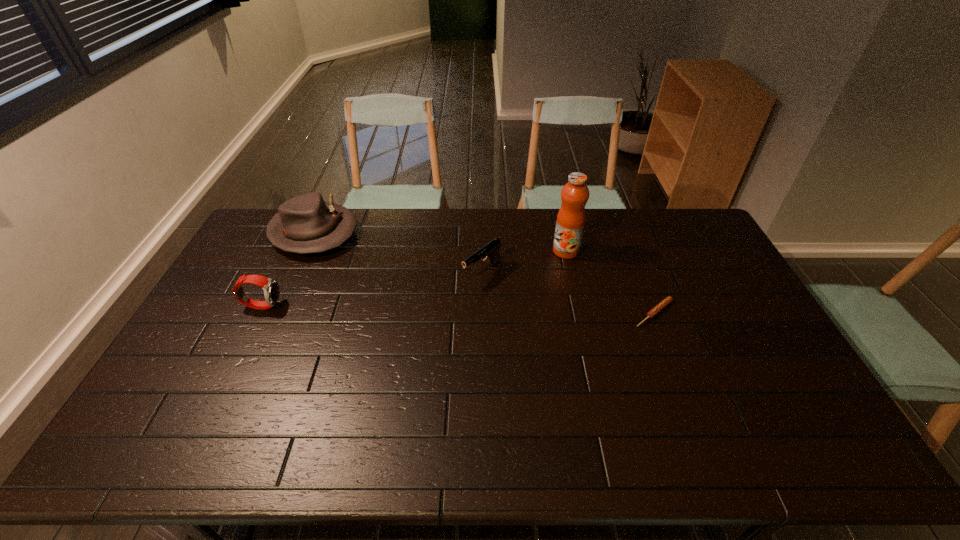
Where is `watch that is at the left edge`? This screenshot has width=960, height=540. watch that is at the left edge is located at coordinates (271, 289).

Where is `hat located at the left edge`? hat located at the left edge is located at coordinates (305, 224).

The image size is (960, 540). In order to click on object that is at the far left corner in this screenshot , I will do `click(305, 224)`.

Locate an element on the screen. free space at the far edge of the desktop is located at coordinates (495, 212).

Locate an element on the screen. free space at the near edge is located at coordinates (315, 393).

Image resolution: width=960 pixels, height=540 pixels. I want to click on vacant region at the right edge of the desktop, so click(x=717, y=280).

Where is `free location at the far left corner of the desktop`? Image resolution: width=960 pixels, height=540 pixels. free location at the far left corner of the desktop is located at coordinates (258, 228).

Identify the location of free space between the watch and the rightmost object. (458, 309).

Where is `free space between the fourth object from left to right and the rightmost object`? free space between the fourth object from left to right and the rightmost object is located at coordinates (610, 282).

At what (x,y) coordinates should I click in order to perform the action: click on free space between the watch and the tallest object. Please return your answer as a coordinate pair (x, y). Looking at the image, I should click on (414, 278).